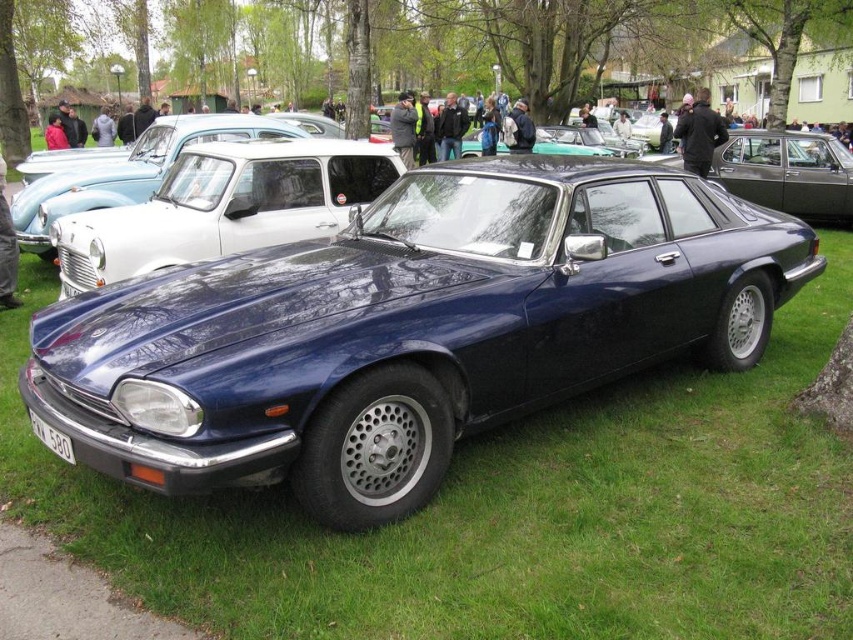
You are a photographer positioned at the edge of the grassy area where the cars are displayed. You want to take a photo that includes both the green textured tree at center and the glossy blue sedan at center. Which object should you focus on first to ensure both are in clear view?

You should focus on the green textured tree at center first because it is closer to you than the glossy blue sedan at center, ensuring both are in clear view.

You are a photographer at a car exhibition. You want to capture the glossy blue sedan at center with the green textured tree at center in the background. Will the tree be visible in the photo if you frame the sedan in the center?

The green textured tree at center is taller than the glossy blue sedan at center, so the tree will be visible in the photo as it extends above the sedan.